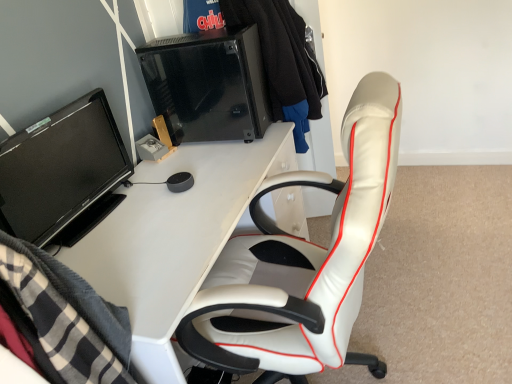
Question: Based on their sizes in the image, would you say white glossy desk at center is bigger or smaller than black fabric jacket at upper center?

Choices:
 (A) big
 (B) small

Answer: (A)

Question: Do you think white glossy desk at center is within black fabric jacket at upper center, or outside of it?

Choices:
 (A) inside
 (B) outside

Answer: (B)

Question: Which object is the farthest from the black glass desktop computer at upper center?

Choices:
 (A) black fabric jacket at upper center
 (B) white leather chair at right
 (C) white glossy desk at center
 (D) black glossy monitor at left

Answer: (B)

Question: Which object is the closest to the black fabric jacket at upper center?

Choices:
 (A) black glass desktop computer at upper center
 (B) white leather chair at right
 (C) white glossy desk at center
 (D) black glossy monitor at left

Answer: (A)